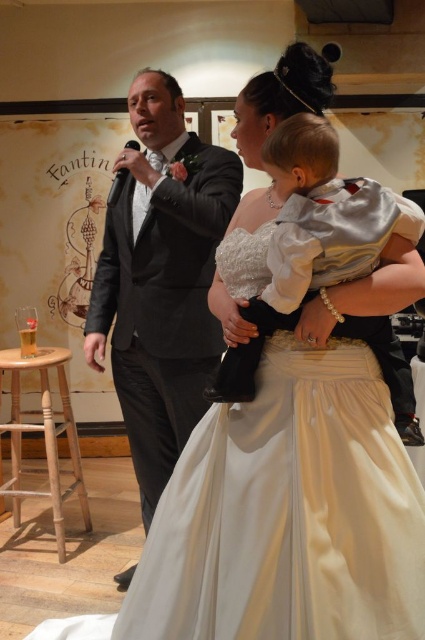
Question: Is matte black suit at center bigger than light brown wooden stool at lower left?

Choices:
 (A) yes
 (B) no

Answer: (B)

Question: Is matte black suit at center thinner than white satin baby at center?

Choices:
 (A) no
 (B) yes

Answer: (A)

Question: Which point is farther to the camera?

Choices:
 (A) matte black suit at center
 (B) white satin baby at center
 (C) light brown wooden stool at lower left

Answer: (C)

Question: Which of the following is the closest to the observer?

Choices:
 (A) matte black suit at center
 (B) light brown wooden stool at lower left
 (C) white satin baby at center

Answer: (C)

Question: Among these points, which one is farthest from the camera?

Choices:
 (A) (153, 76)
 (B) (8, 362)

Answer: (B)

Question: Is matte black suit at center to the left of white satin baby at center from the viewer's perspective?

Choices:
 (A) yes
 (B) no

Answer: (A)